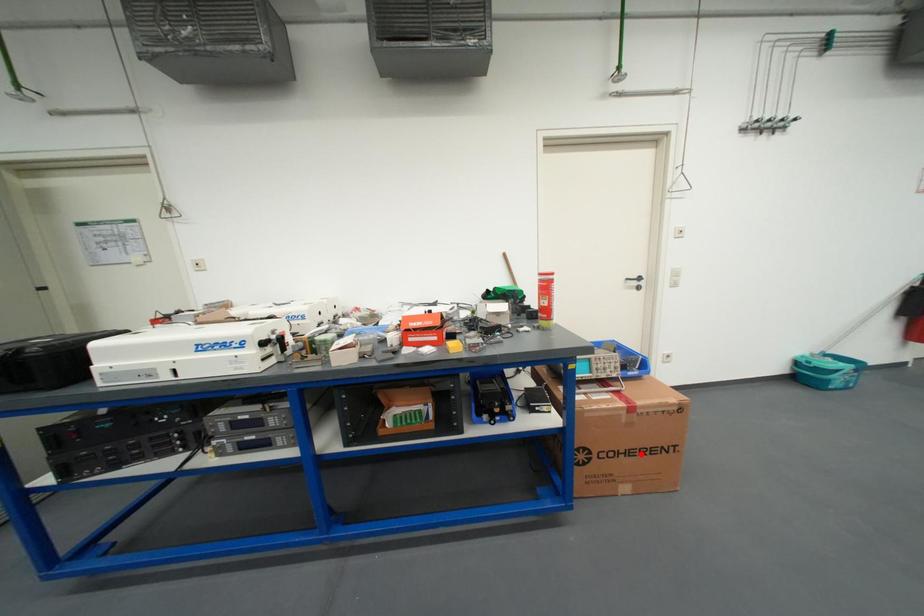
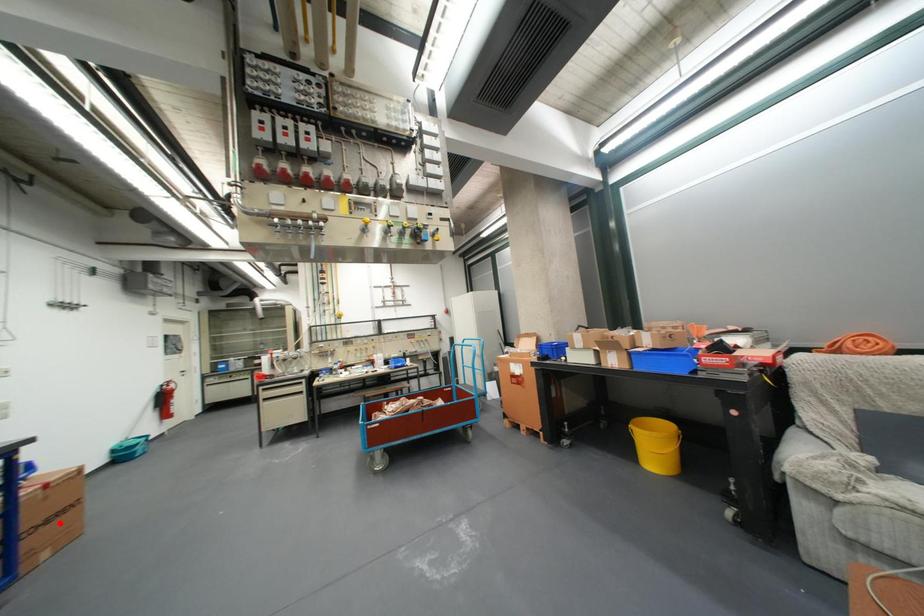
I am providing you with two images of the same scene from different viewpoints. A red point is marked on the first image and another point is marked on the second image. Does the point marked in image1 correspond to the same location as the one in image2?

Yes